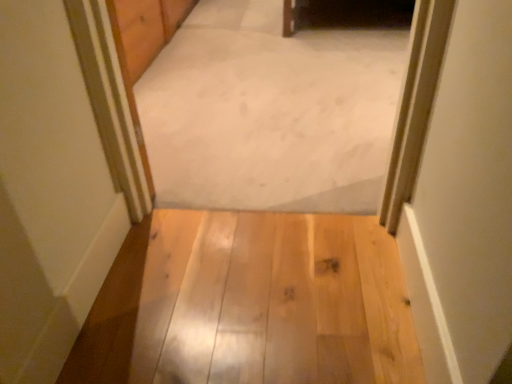
Locate an element on the screen. The width and height of the screenshot is (512, 384). light wood floor at center is located at coordinates (272, 301).

This screenshot has height=384, width=512. Describe the element at coordinates (272, 301) in the screenshot. I see `light wood floor at center` at that location.

Locate an element on the screen. The height and width of the screenshot is (384, 512). white carpet at center is located at coordinates (270, 112).

This screenshot has height=384, width=512. Describe the element at coordinates (270, 112) in the screenshot. I see `white carpet at center` at that location.

Locate an element on the screen. The image size is (512, 384). light wood floor at center is located at coordinates (272, 301).

Is light wood floor at center to the right of white carpet at center from the viewer's perspective?

No, light wood floor at center is not to the right of white carpet at center.

Is the depth of light wood floor at center less than that of white carpet at center?

That is True.

Which is farther, (160, 328) or (259, 171)?

Positioned behind is point (259, 171).

From the image's perspective, is light wood floor at center on white carpet at center?

Actually, light wood floor at center appears below white carpet at center in the image.

From a real-world perspective, is light wood floor at center physically located above or below white carpet at center?

Clearly, from a real-world perspective, light wood floor at center is above white carpet at center.

Can you confirm if light wood floor at center is thinner than white carpet at center?

Yes, light wood floor at center is thinner than white carpet at center.

Considering the relative sizes of light wood floor at center and white carpet at center in the image provided, is light wood floor at center shorter than white carpet at center?

Correct, light wood floor at center is not as tall as white carpet at center.

Can you confirm if light wood floor at center is bigger than white carpet at center?

Actually, light wood floor at center might be smaller than white carpet at center.

Is white carpet at center a part of light wood floor at center?

Definitely not — white carpet at center is not inside light wood floor at center.

Is light wood floor at center next to white carpet at center?

light wood floor at center is not next to white carpet at center, and they're not touching.

Is light wood floor at center facing away from white carpet at center?

No, light wood floor at center is not facing the opposite direction of white carpet at center.

How many degrees apart are the facing directions of light wood floor at center and white carpet at center?

The facing directions of light wood floor at center and white carpet at center are 180 degrees apart.

At what (x,y) coordinates should I click in order to perform the action: click on path above the white carpet at center (from a real-world perspective). Please return your answer as a coordinate pair (x, y). This screenshot has width=512, height=384. Looking at the image, I should click on (272, 301).

From the picture: Is white carpet at center to the left of light wood floor at center from the viewer's perspective?

No.

Is white carpet at center in front of or behind light wood floor at center in the image?

Visually, white carpet at center is located behind light wood floor at center.

Which is closer, (222,3) or (380,294)?

Point (222,3) appears to be farther away from the viewer than point (380,294).

From the image's perspective, which is below, white carpet at center or light wood floor at center?

light wood floor at center.

From a real-world perspective, is white carpet at center located higher than light wood floor at center?

No.

Is white carpet at center wider or thinner than light wood floor at center?

white carpet at center is wider than light wood floor at center.

Is white carpet at center taller or shorter than light wood floor at center?

white carpet at center is taller than light wood floor at center.

Consider the image. Is white carpet at center bigger than light wood floor at center?

Yes.

Is light wood floor at center a part of white carpet at center?

No, light wood floor at center is not inside white carpet at center.

Is white carpet at center in contact with light wood floor at center?

No, white carpet at center is not making contact with light wood floor at center.

Is light wood floor at center at the back of white carpet at center?

No.

Can you tell me how much white carpet at center and light wood floor at center differ in facing direction?

The angular difference between white carpet at center and light wood floor at center is 180 degrees.

Measure the distance between white carpet at center and light wood floor at center.

white carpet at center is 30.75 inches from light wood floor at center.

Identify the location of passage that appears above the light wood floor at center (from the image's perspective). (270, 112).

At what (x,y) coordinates should I click in order to perform the action: click on path in front of the white carpet at center. Please return your answer as a coordinate pair (x, y). The image size is (512, 384). Looking at the image, I should click on (272, 301).

Where is `passage behind the light wood floor at center`? passage behind the light wood floor at center is located at coordinates (270, 112).